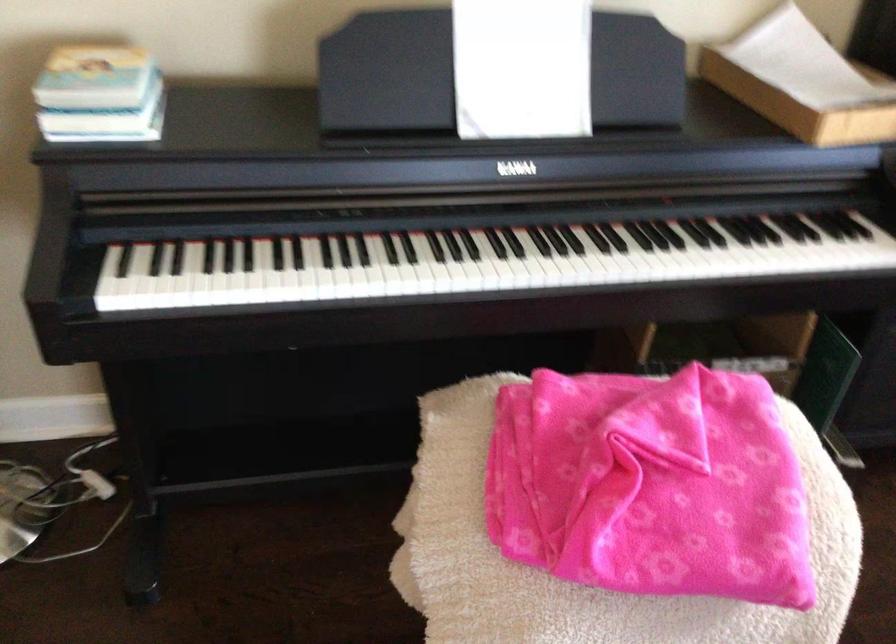
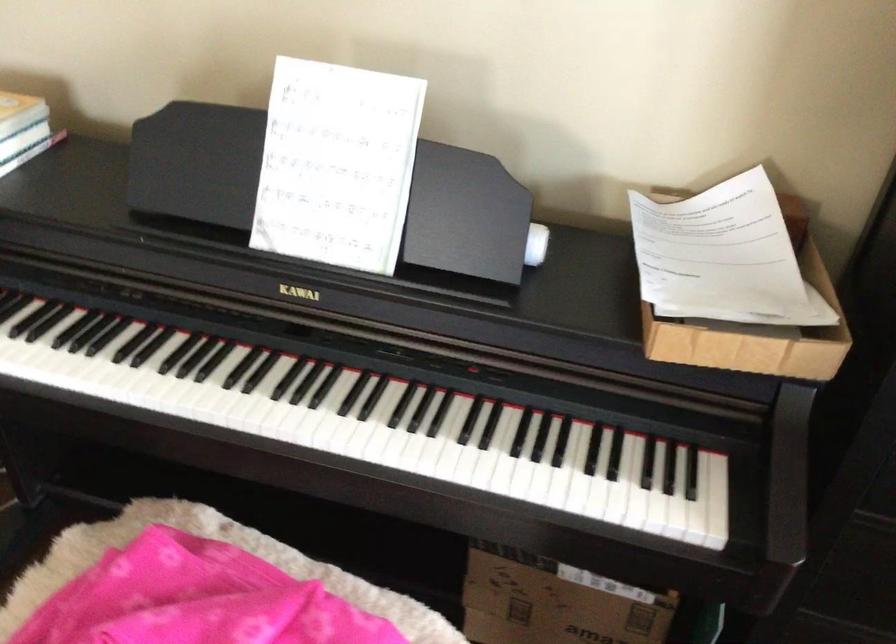
In a continuous first-person perspective shot, in which direction is the camera moving?

The cameraman moved toward right, forward.